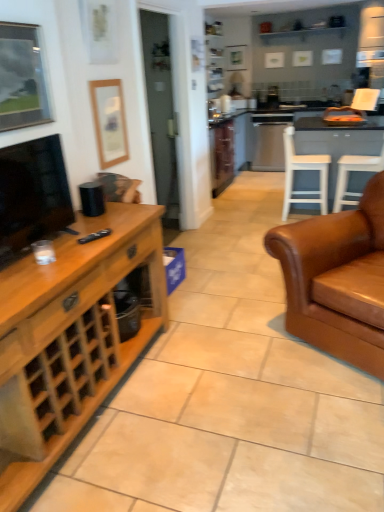
The width and height of the screenshot is (384, 512). What are the coordinates of `free region on the left part of black matte remote at center` in the screenshot? It's located at (79, 237).